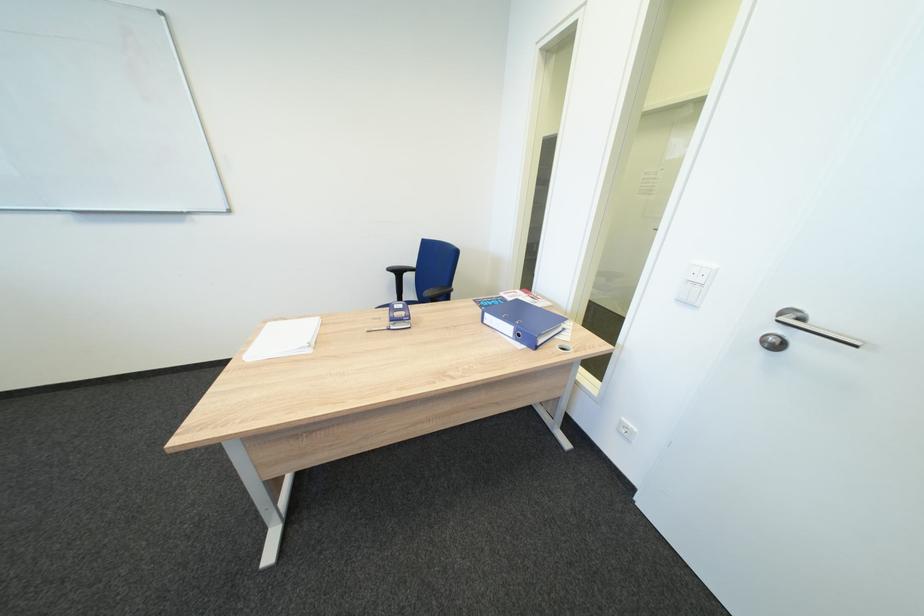
What do you see at coordinates (399, 269) in the screenshot? I see `the black chair armrest` at bounding box center [399, 269].